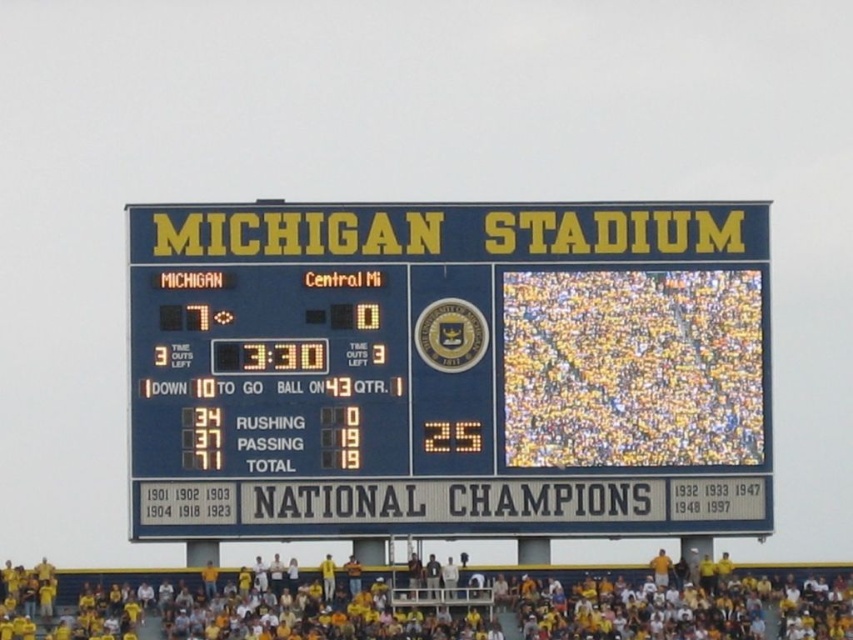
Question: Is blue plastic scoreboard at center above yellow fabric at lower center?

Choices:
 (A) yes
 (B) no

Answer: (A)

Question: Can you confirm if blue plastic scoreboard at center is wider than yellow fabric at lower center?

Choices:
 (A) yes
 (B) no

Answer: (B)

Question: Which point is farther to the camera?

Choices:
 (A) yellow fabric at lower center
 (B) blue plastic scoreboard at center

Answer: (B)

Question: Does blue plastic scoreboard at center appear on the right side of yellow fabric at lower center?

Choices:
 (A) no
 (B) yes

Answer: (B)

Question: Which point is farther to the camera?

Choices:
 (A) (161, 236)
 (B) (706, 636)

Answer: (A)